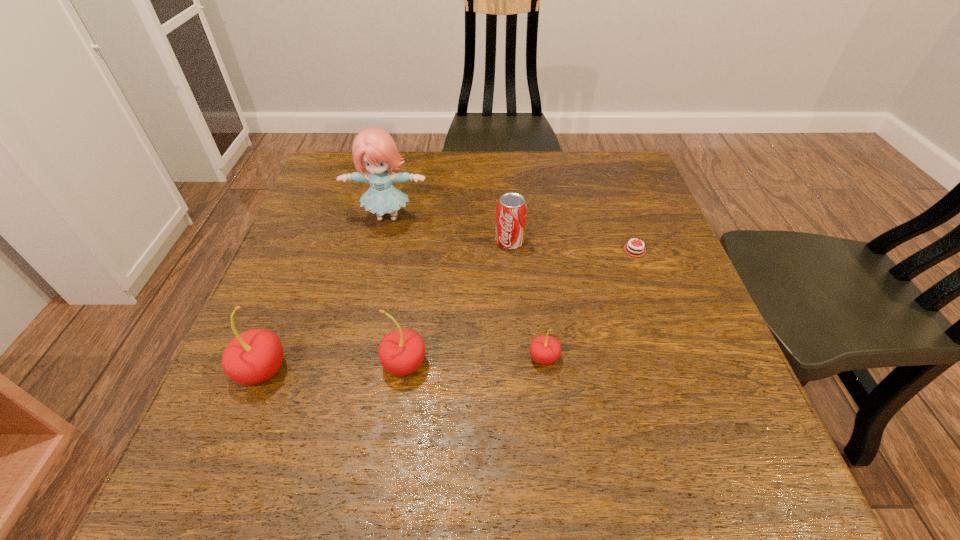
This screenshot has height=540, width=960. I want to click on free space between the soda can and the second tallest cherry, so click(x=457, y=303).

Find the location of a particular element. unoccupied position between the second shortest cherry and the fourth tallest object is located at coordinates (457, 303).

What are the coordinates of `free space between the leftmost cherry and the soda can` in the screenshot? It's located at (386, 306).

Identify the location of object that is the fifth closest to the farthest object. (640, 251).

Locate an element on the screen. This screenshot has width=960, height=540. object identified as the third closest to the doll is located at coordinates (252, 357).

In order to click on cherry identified as the closest to the leftmost cherry in this screenshot , I will do `click(401, 352)`.

Locate an element on the screen. The width and height of the screenshot is (960, 540). the closest cherry relative to the leftmost cherry is located at coordinates (401, 352).

At what (x,y) coordinates should I click in order to perform the action: click on vacant space that satisfies the following two spatial constraints: 1. on the front-facing side of the farthest object; 2. on the right side of the soda can. Please return your answer as a coordinate pair (x, y). This screenshot has height=540, width=960. Looking at the image, I should click on (382, 242).